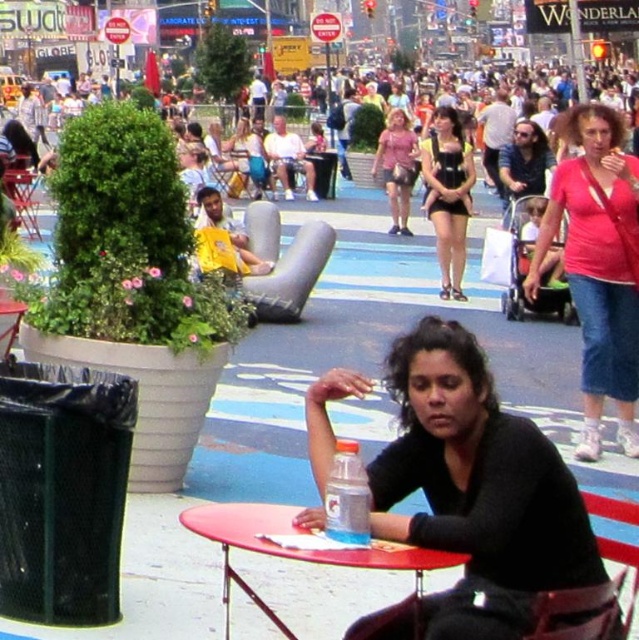
You are a photographer trying to capture a candid shot of the woman in the black matte swimsuit at center. However, the smooth plastic table at center is blocking your view. Can you adjust your position to see her clearly?

The smooth plastic table at center is positioned under the black matte swimsuit at center, so moving your camera angle slightly upward should allow you to see the black matte swimsuit at center clearly without obstruction.

You are a photographer standing in the plaza and want to take a photo of the pink fabric shirt at upper right and the metallic silver chair at center. Which object should you focus on first to ensure both are in focus?

You should focus on the pink fabric shirt at upper right first since it is closer to the viewer than the metallic silver chair at center, so adjusting focus from near to far will help both be in focus.

You are standing in the plaza and want to take a photo of both the woman at point [450,211] and the person at point [256,184]. Which point should you focus on first to ensure both are in clear view?

You should focus on point [450,211] first because it is closer to the viewer than point [256,184], ensuring both are in clear view.